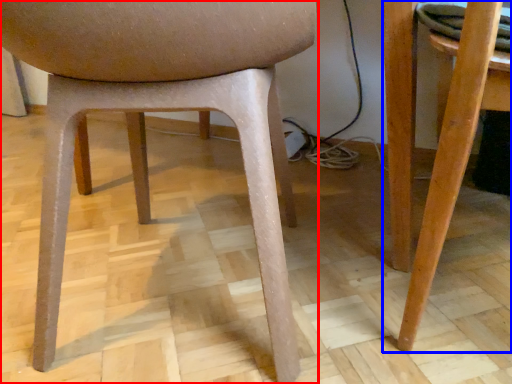
Question: Which point is closer to the camera, chair (highlighted by a red box) or table (highlighted by a blue box)?

Choices:
 (A) chair
 (B) table

Answer: (A)